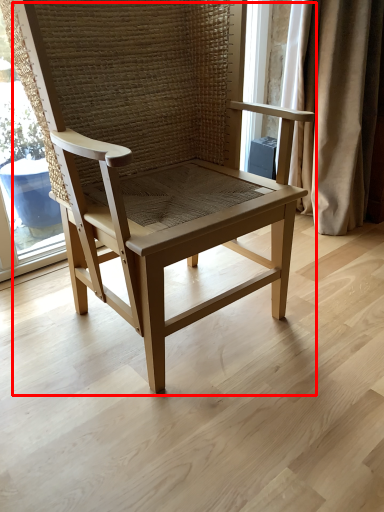
Question: From the image's perspective, where is chair (annotated by the red box) located relative to curtain?

Choices:
 (A) above
 (B) below

Answer: (B)